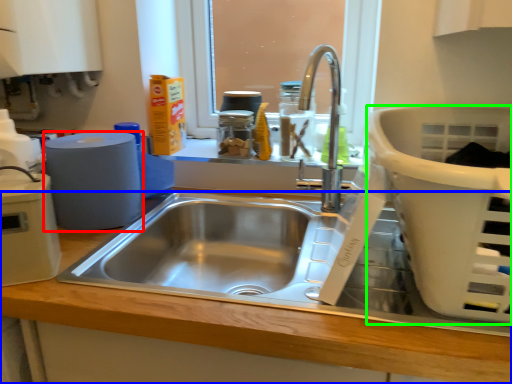
Question: Which object is the farthest from paper towel (highlighted by a red box)? Choose among these: counter top (highlighted by a blue box) or basket (highlighted by a green box).

Choices:
 (A) counter top
 (B) basket

Answer: (B)